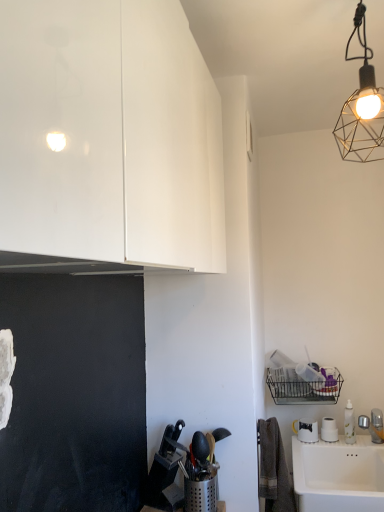
Question: Is white ceramic sink at lower right wider or thinner than glossy white cabinet at upper left?

Choices:
 (A) wide
 (B) thin

Answer: (A)

Question: Looking at the image, does white ceramic sink at lower right seem bigger or smaller compared to glossy white cabinet at upper left?

Choices:
 (A) small
 (B) big

Answer: (A)

Question: Which object is positioned closest to the metallic wire mesh at upper right?

Choices:
 (A) glossy white cabinet at upper left
 (B) white ceramic sink at lower right

Answer: (A)

Question: Estimate the real-world distances between objects in this image. Which object is farther from the glossy white cabinet at upper left?

Choices:
 (A) metallic wire mesh at upper right
 (B) white ceramic sink at lower right

Answer: (B)